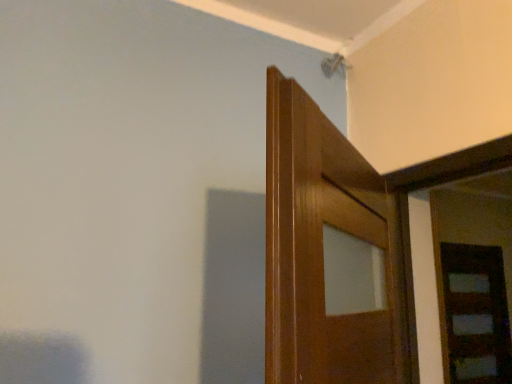
Locate an element on the screen. brown wooden screen door at right is located at coordinates (476, 314).

Measure the distance between point (467, 355) and camera.

The distance of point (467, 355) from camera is 3.63 meters.

What do you see at coordinates (476, 314) in the screenshot? This screenshot has width=512, height=384. I see `brown wooden screen door at right` at bounding box center [476, 314].

Find the location of a particular element. brown wooden screen door at right is located at coordinates (476, 314).